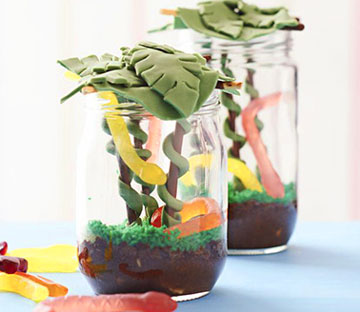
Identify the location of jar on the background. The width and height of the screenshot is (360, 312). click(x=257, y=228).